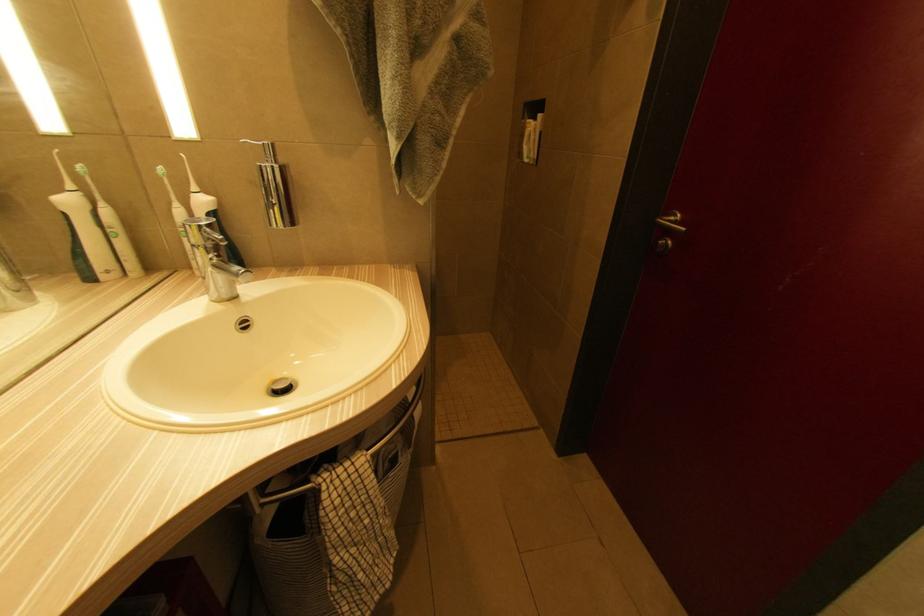
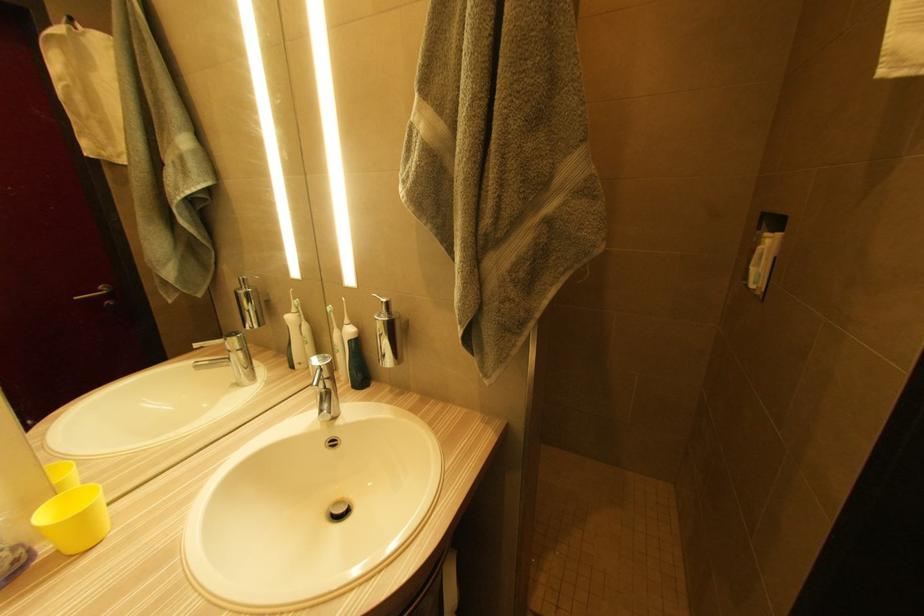
Question: The camera is either moving clockwise (left) or counter-clockwise (right) around the object. The first image is from the beginning of the video and the second image is from the end. Is the camera moving left or right when shooting the video?

Choices:
 (A) Left
 (B) Right

Answer: (B)